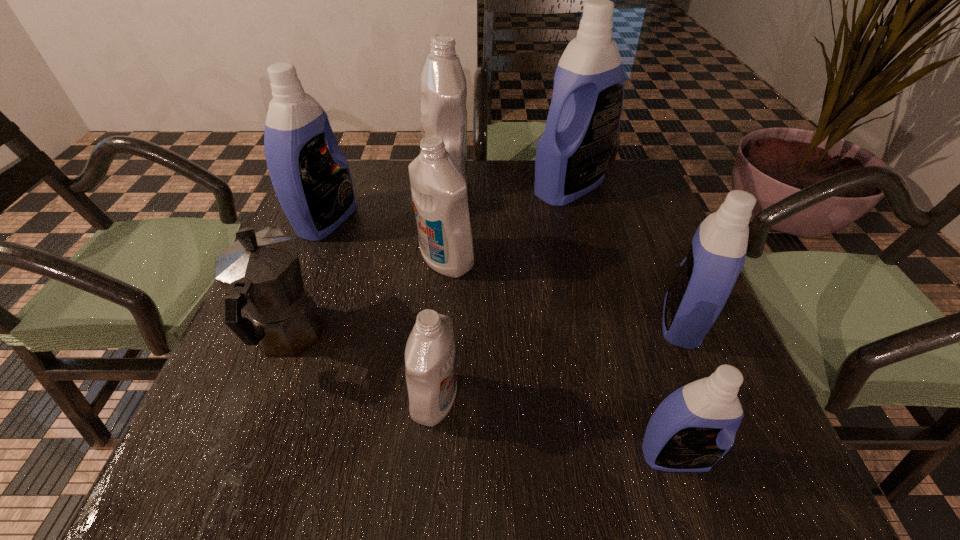
Find the location of a particular element. vacant area that lies between the farthest white detergent and the second nearest detergent is located at coordinates (440, 291).

In order to click on vacant space that's between the fifth farthest detergent and the coffeepot in this screenshot , I will do `click(485, 329)`.

The width and height of the screenshot is (960, 540). I want to click on the third closest object to the coffeepot, so click(x=430, y=360).

I want to click on object that can be found as the third closest to the third smallest blue detergent, so click(x=439, y=191).

Identify which detergent is located as the sixth nearest to the farthest white detergent. Please provide its 2D coordinates. Your answer should be formatted as a tuple, i.e. [(x, y)], where the tuple contains the x and y coordinates of a point satisfying the conditions above.

[(695, 426)]

At what (x,y) coordinates should I click in order to perform the action: click on detergent that stands as the fifth closest to the biggest blue detergent. Please return your answer as a coordinate pair (x, y). The image size is (960, 540). Looking at the image, I should click on (430, 360).

At what (x,y) coordinates should I click in order to perform the action: click on the third closest blue detergent to the nearest object. Please return your answer as a coordinate pair (x, y). The height and width of the screenshot is (540, 960). Looking at the image, I should click on (313, 184).

At what (x,y) coordinates should I click in order to perform the action: click on blue detergent that stands as the third closest to the leftmost detergent. Please return your answer as a coordinate pair (x, y). Looking at the image, I should click on (695, 426).

This screenshot has width=960, height=540. In order to click on white detergent that can be found as the closest to the third smallest blue detergent in this screenshot , I will do `click(443, 84)`.

Find the location of a particular element. The width and height of the screenshot is (960, 540). white detergent that is the second nearest to the biggest blue detergent is located at coordinates (439, 191).